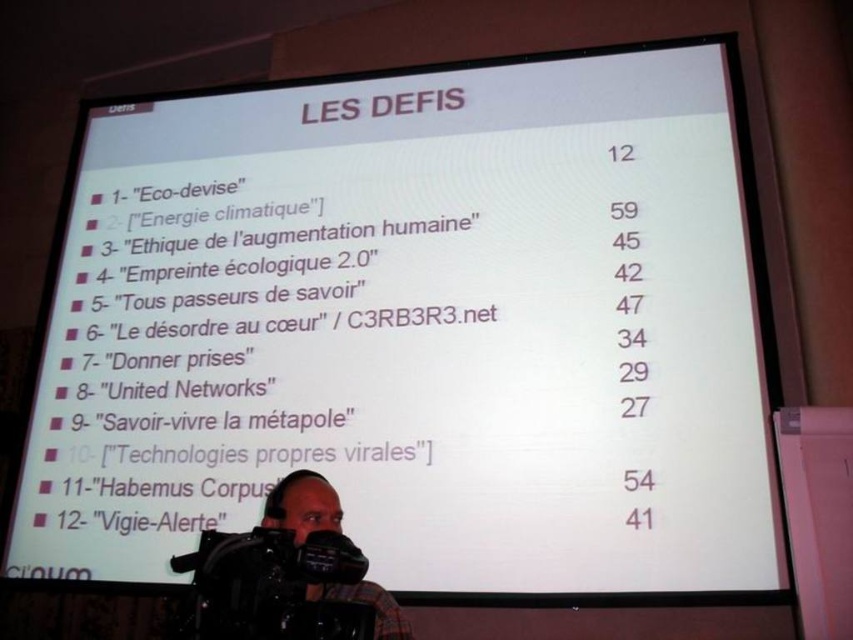
Question: Which point is farther to the camera?

Choices:
 (A) (285, 580)
 (B) (339, 500)

Answer: (B)

Question: Is black plastic camera at lower left to the left of plaid fabric camera at lower center from the viewer's perspective?

Choices:
 (A) yes
 (B) no

Answer: (A)

Question: Does black plastic camera at lower left appear on the left side of plaid fabric camera at lower center?

Choices:
 (A) no
 (B) yes

Answer: (B)

Question: Which point appears closest to the camera in this image?

Choices:
 (A) (300, 502)
 (B) (258, 545)

Answer: (B)

Question: Can you confirm if black plastic camera at lower left is wider than plaid fabric camera at lower center?

Choices:
 (A) no
 (B) yes

Answer: (A)